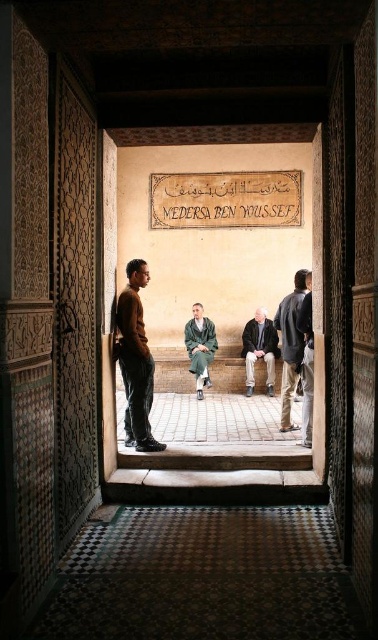
You are standing in the Medersa Ben Youssef and want to exit through the carved wood door at left while avoiding the brown wool sweater at left. Since both are on your left side, which one should you move towards first to exit?

You should move towards the carved wood door at left first because it is positioned to the left of the brown wool sweater at left, meaning it is closer to you.

You are standing at the carved wood door at left. You want to walk to the group of people sitting on the low stone bench through the doorway. How many steps do you need to take if each step is 2.5 feet?

The distance between the carved wood door at left and the group of people is 10.12 feet. Dividing this by 2.5 feet per step gives approximately 4.05 steps. Since you can only take whole steps, you would need to take 5 steps to reach them.

You are a tour guide explaining the historical significance of the Medersa Ben Youssef to visitors. You notice two items of clothing at the center of the scene. How far apart are the dark gray fabric jacket at center and the green woolen robe at center?

The dark gray fabric jacket at center is 31.82 inches from the green woolen robe at center.